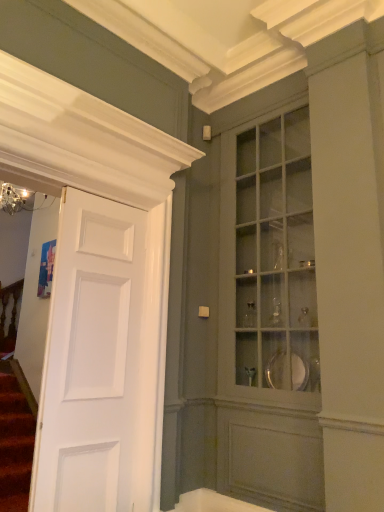
Question: Visually, is white glossy bathtub at lower center positioned to the left or to the right of matte glass cabinet at center?

Choices:
 (A) right
 (B) left

Answer: (B)

Question: From the image's perspective, relative to matte glass cabinet at center, is white glossy bathtub at lower center above or below?

Choices:
 (A) above
 (B) below

Answer: (B)

Question: Estimate the real-world distances between objects in this image. Which object is farther from the white glossy bathtub at lower center?

Choices:
 (A) white matte door at left
 (B) matte glass cabinet at center

Answer: (B)

Question: Which is nearer to the white glossy bathtub at lower center?

Choices:
 (A) white matte door at left
 (B) matte glass cabinet at center

Answer: (A)